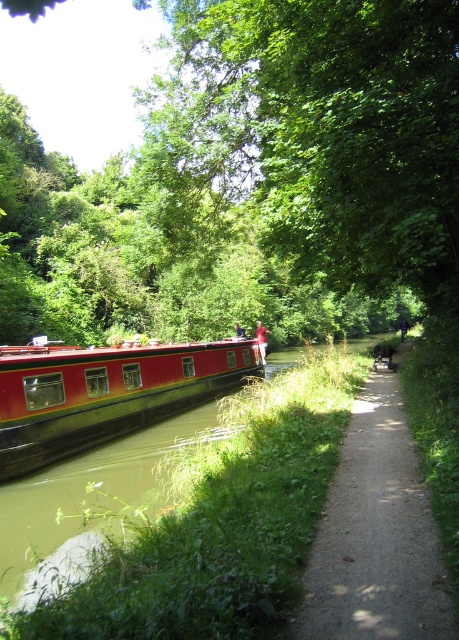
You are a delivery person trying to deliver a package to the red polished wood barge at left. You are standing on the dirt path at center. Can you easily step onto the barge from the path?

The dirt path at center is not as tall as the red polished wood barge at left, so you cannot easily step onto the barge from the path because the barge is higher.